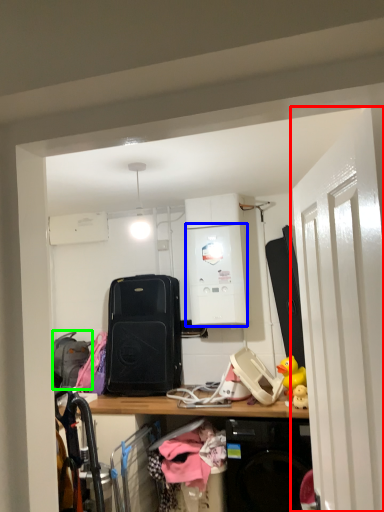
Question: Considering the real-world distances, which object is closest to door (highlighted by a red box)? appliance (highlighted by a blue box) or luggage (highlighted by a green box).

Choices:
 (A) appliance
 (B) luggage

Answer: (A)